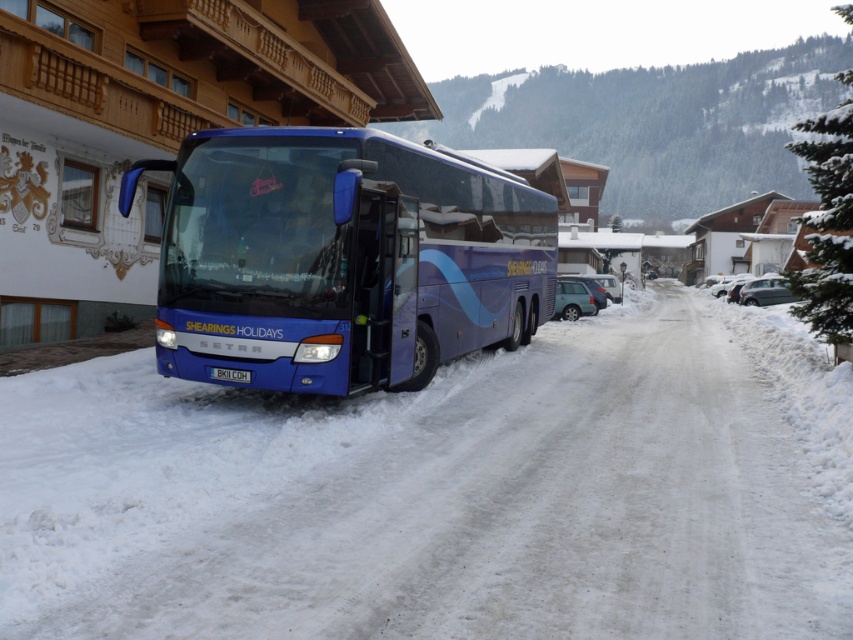
You are a tour guide standing next to the blue metallic bus at center. You want to walk to the wooden building in the background. Is the white powdery snow at center between you and the wooden building?

The distance between the white powery snow at center and the blue metallic bus at center is 7.57 feet. Since the snow is between the bus and the building, you would have to walk through the snow to reach the building.

You are a tour guide standing on the snow and looking at the bus. Is the blue metallic bus at center above or below the white powdery snow at center?

The white powdery snow at center is located below the blue metallic bus at center, so the blue metallic bus at center is above the white powdery snow at center.

You are standing at the front of the bus and want to walk towards the wooden building. Is the white powdery snow at center in your path?

The white powdery snow at center is located at point (444, 492), so yes, it is in your path between the bus and the wooden building.